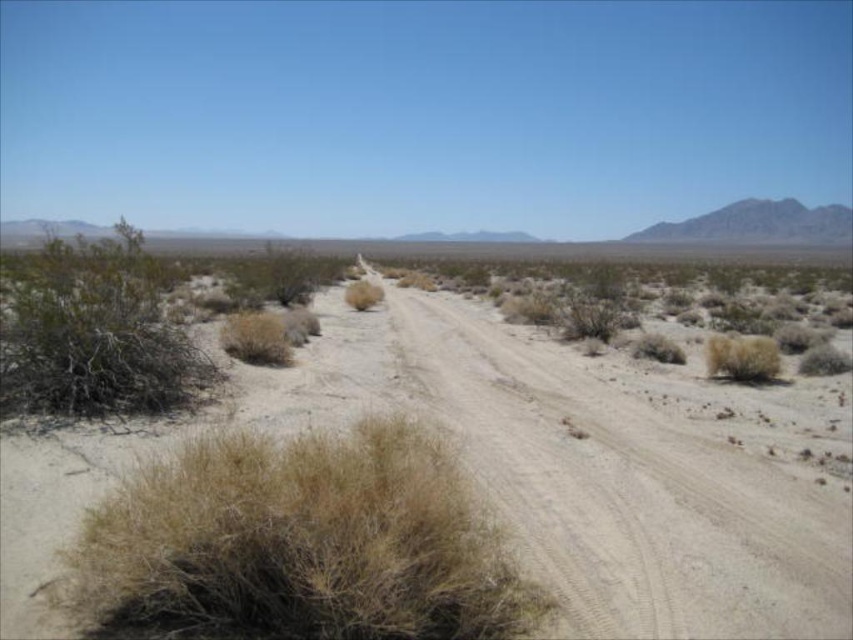
Question: Does dusty sand at center appear under brown dry bush at left?

Choices:
 (A) no
 (B) yes

Answer: (B)

Question: Estimate the real-world distances between objects in this image. Which object is farther from the dry grass at lower left?

Choices:
 (A) brown dry bush at left
 (B) dusty sand at center

Answer: (A)

Question: Does dry grass at lower left lie behind brown dry bush at left?

Choices:
 (A) yes
 (B) no

Answer: (B)

Question: Which point appears closest to the camera in this image?

Choices:
 (A) coord(454,618)
 (B) coord(99,381)

Answer: (A)

Question: Is dusty sand at center positioned behind dry grass at lower left?

Choices:
 (A) no
 (B) yes

Answer: (B)

Question: Which is farther from the brown dry bush at left?

Choices:
 (A) dry grass at lower left
 (B) dusty sand at center

Answer: (B)